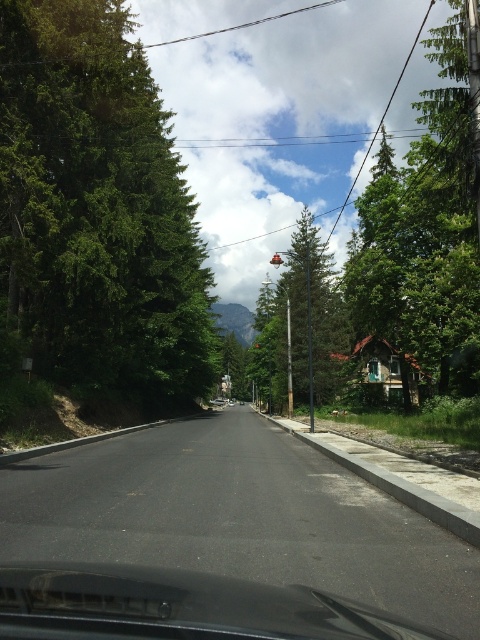
Who is more distant from viewer, (286, 605) or (322, 348)?

The point (322, 348) is behind.

What do you see at coordinates (180, 608) in the screenshot?
I see `transparent glass windshield at center` at bounding box center [180, 608].

Where is `transparent glass windshield at center`? transparent glass windshield at center is located at coordinates (180, 608).

The image size is (480, 640). Describe the element at coordinates (96, 205) in the screenshot. I see `green leafy tree at left` at that location.

Is green leafy tree at left to the left of transparent glass windshield at center from the viewer's perspective?

Correct, you'll find green leafy tree at left to the left of transparent glass windshield at center.

I want to click on green leafy tree at left, so pos(96,205).

Does green leafy tree at upper center have a greater height compared to transparent glass windshield at center?

Yes.

Does point (277, 397) come closer to viewer compared to point (291, 609)?

No, it is not.

Between point (470, 140) and point (118, 572), which one is positioned behind?

The point (470, 140) is more distant.

This screenshot has height=640, width=480. I want to click on green leafy tree at upper center, so click(428, 220).